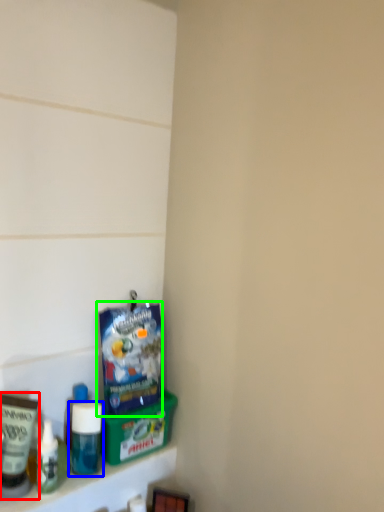
Question: Which object is the farthest from toiletry (highlighted by a red box)? Choose among these: bottle (highlighted by a blue box) or product (highlighted by a green box).

Choices:
 (A) bottle
 (B) product

Answer: (B)